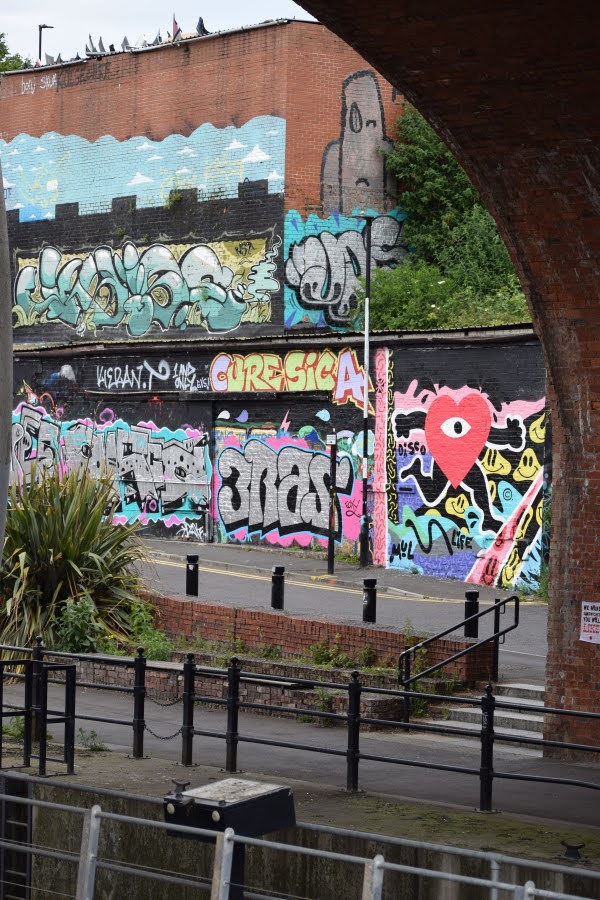
Locate an element on the screen. The image size is (600, 900). plant is located at coordinates 78,544.